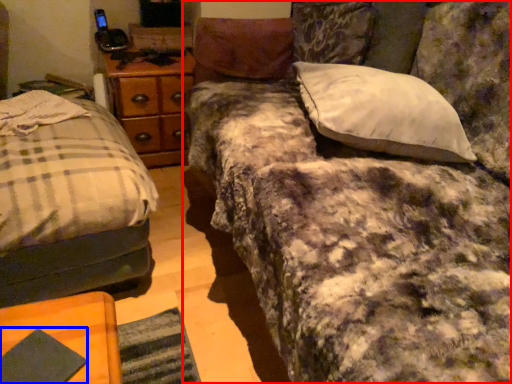
Question: Which point is closer to the camera, studio couch (highlighted by a red box) or pad (highlighted by a blue box)?

Choices:
 (A) studio couch
 (B) pad

Answer: (A)